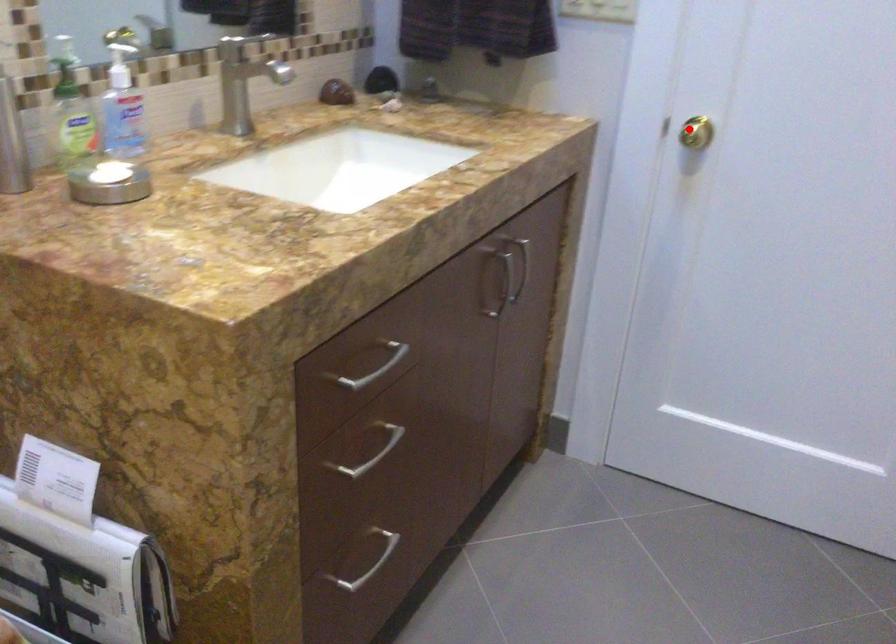
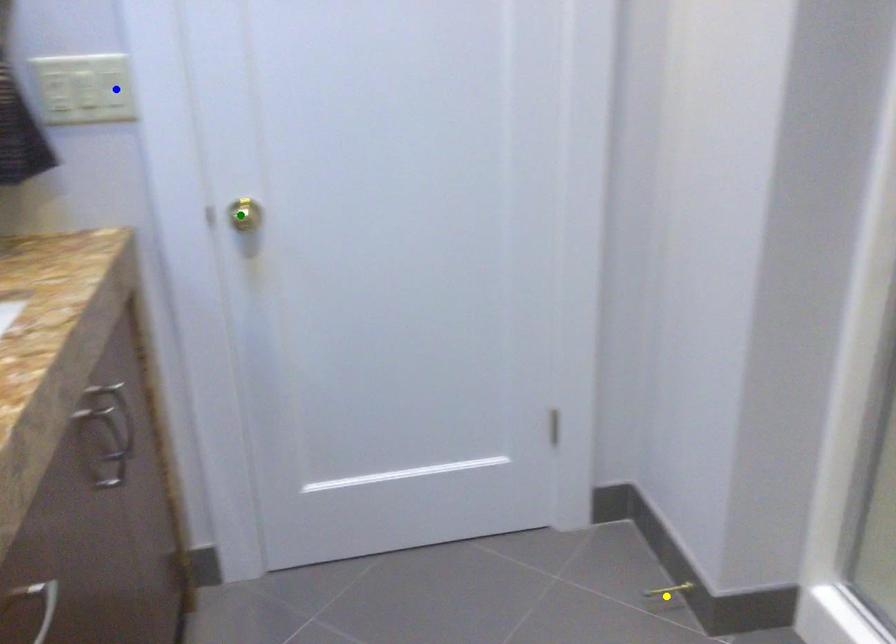
Question: I am providing you with two images of the same scene from different viewpoints. A red point is marked on the first image. You are given multiple points on the second image. Which spot in image 2 lines up with the point in image 1?

Choices:
 (A) yellow point
 (B) blue point
 (C) green point

Answer: (C)